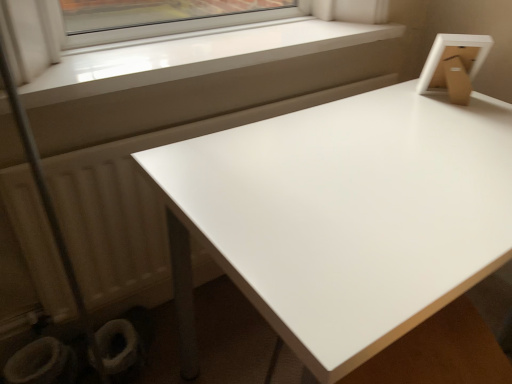
Question: Is white matte radiator at lower left positioned beyond the bounds of white fabric toilet bowl at lower left, the 1th toilet bowl positioned from the right?

Choices:
 (A) yes
 (B) no

Answer: (A)

Question: Does white matte radiator at lower left have a greater height compared to white fabric toilet bowl at lower left, which appears as the 2th toilet bowl when viewed from the left?

Choices:
 (A) yes
 (B) no

Answer: (A)

Question: Is white matte radiator at lower left positioned with its back to white fabric toilet bowl at lower left, the 1th toilet bowl positioned from the right?

Choices:
 (A) yes
 (B) no

Answer: (B)

Question: From the image's perspective, does white matte radiator at lower left appear higher than white fabric toilet bowl at lower left, the 1th toilet bowl positioned from the right?

Choices:
 (A) no
 (B) yes

Answer: (B)

Question: Is white matte radiator at lower left positioned in front of white fabric toilet bowl at lower left, which appears as the 2th toilet bowl when viewed from the left?

Choices:
 (A) yes
 (B) no

Answer: (A)

Question: Considering the relative sizes of white matte radiator at lower left and white fabric toilet bowl at lower left, the 1th toilet bowl positioned from the right, in the image provided, is white matte radiator at lower left thinner than white fabric toilet bowl at lower left, the 1th toilet bowl positioned from the right,?

Choices:
 (A) yes
 (B) no

Answer: (B)

Question: Does white glossy table at upper right turn towards white matte radiator at lower left?

Choices:
 (A) yes
 (B) no

Answer: (B)

Question: Does white glossy table at upper right lie in front of white matte radiator at lower left?

Choices:
 (A) no
 (B) yes

Answer: (B)

Question: Is white glossy table at upper right shorter than white matte radiator at lower left?

Choices:
 (A) yes
 (B) no

Answer: (B)

Question: Is white glossy table at upper right outside white matte radiator at lower left?

Choices:
 (A) yes
 (B) no

Answer: (A)

Question: Is white glossy table at upper right smaller than white matte radiator at lower left?

Choices:
 (A) yes
 (B) no

Answer: (B)

Question: Can you confirm if white glossy table at upper right is taller than white matte radiator at lower left?

Choices:
 (A) no
 (B) yes

Answer: (B)

Question: From a real-world perspective, is white glossy toilet bowl at lower left, the 1th toilet bowl viewed from the left, over white smooth window sill at upper left?

Choices:
 (A) yes
 (B) no

Answer: (B)